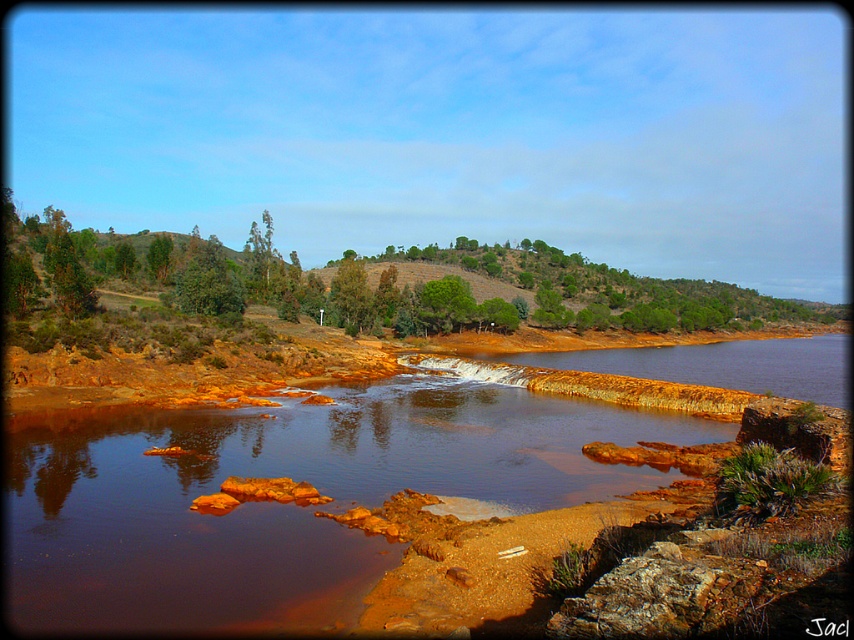
You are standing on the bank of the river and want to cross to the other side. You see a brown rock at center and a green matte tree at center. Which object is closer to you, and can you use either to help cross the river?

The brown rock at center is closer to you than the green matte tree at center. Since the brown rock at center is smaller in size, it might be easier to step on to cross the river, while the green matte tree at center could provide stability if needed.

You are standing at the edge of the river and want to place a small decorative stone at each of the two points marked in the image. Which point, point (x=336, y=419) or point (x=693, y=348), will appear closer to you when viewed from your current position?

Point (x=336, y=419) is closer to the camera than point (x=693, y=348), so it will appear closer to you when viewed from your current position.